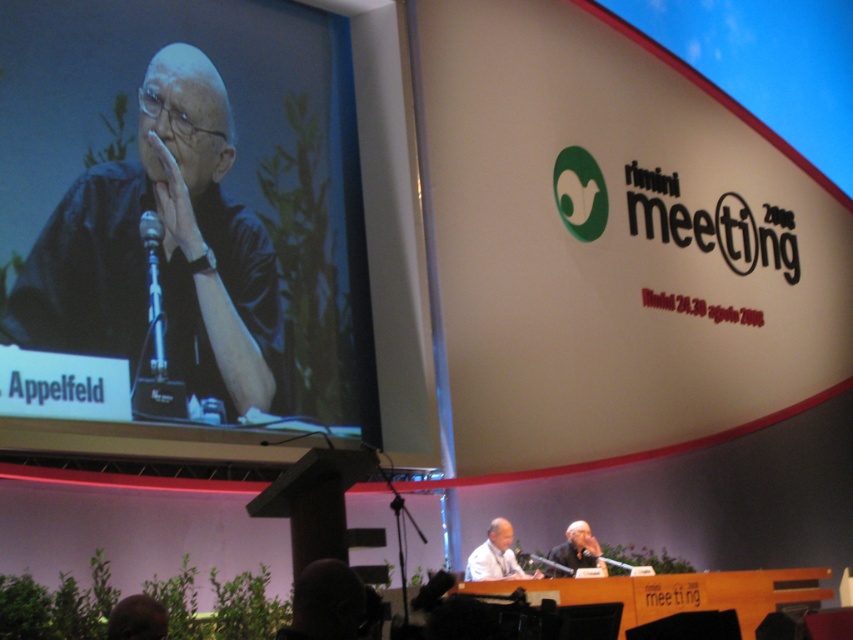
You are setting up for a presentation and need to place a large banner on the beige matte projection screen at upper center. The banner is as wide as the black plastic microphone at upper left. Will the banner fit horizontally on the screen?

The beige matte projection screen at upper center is wider than the black plastic microphone at upper left, so the banner, which is as wide as the microphone, will fit horizontally on the screen.

What is the color and material of the object located at coordinates point (496, 556) in the image?

The object at point (496, 556) is light beige fabric.